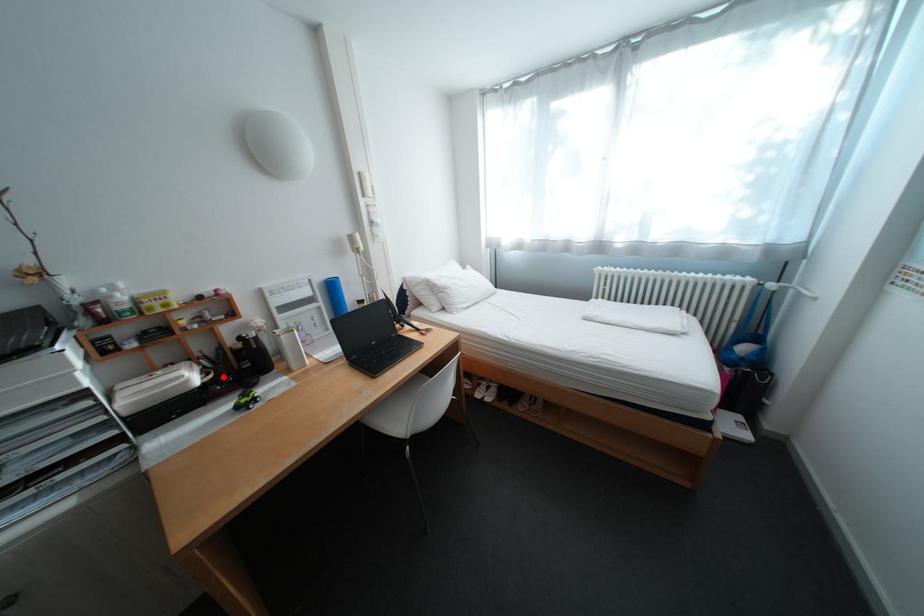
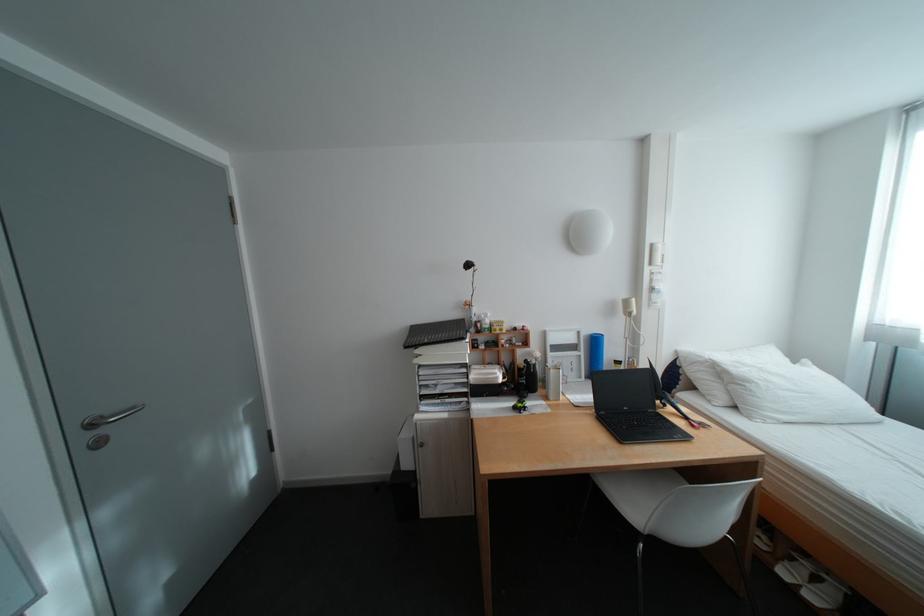
Question: A red point is marked in image1. In image2, is the corresponding 3D point closer to the camera or farther? Reply with the corresponding letter.

Choices:
 (A) The corresponding 3D point is closer.
 (B) The corresponding 3D point is farther.

Answer: (B)